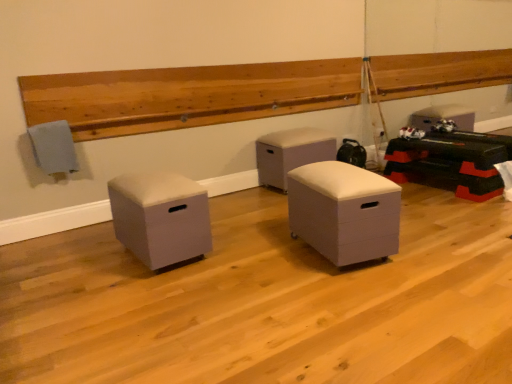
Question: Should I look upward or downward to see white leather ottoman at center, acting as the 2th furniture starting from the left?

Choices:
 (A) up
 (B) down

Answer: (A)

Question: Which direction should I rotate to look at white matte storage ottoman at center, which is counted as the third furniture, starting from the back?

Choices:
 (A) left
 (B) right

Answer: (B)

Question: From a real-world perspective, is white leather ottoman at center, the 2th furniture in the right-to-left sequence, positioned under matte gray ottoman at left, which is the 1th furniture from left to right, based on gravity?

Choices:
 (A) no
 (B) yes

Answer: (A)

Question: Can you confirm if white leather ottoman at center, the 1th furniture in the back-to-front sequence, is smaller than matte gray ottoman at left, the second furniture positioned from the back?

Choices:
 (A) yes
 (B) no

Answer: (B)

Question: Can you confirm if white leather ottoman at center, the 2th furniture in the right-to-left sequence, is taller than matte gray ottoman at left, which is the 1th furniture from left to right?

Choices:
 (A) no
 (B) yes

Answer: (B)

Question: Is white leather ottoman at center, acting as the 2th furniture starting from the left, oriented away from matte gray ottoman at left, the second furniture positioned from the back?

Choices:
 (A) yes
 (B) no

Answer: (B)

Question: Is white leather ottoman at center, acting as the 2th furniture starting from the left, not inside matte gray ottoman at left, which is the 1th furniture from left to right?

Choices:
 (A) yes
 (B) no

Answer: (A)

Question: Can you confirm if white leather ottoman at center, acting as the 2th furniture starting from the left, is shorter than matte gray ottoman at left, the third furniture when ordered from right to left?

Choices:
 (A) yes
 (B) no

Answer: (B)

Question: From the image's perspective, does white leather ottoman at center, which appears as the 3th furniture when viewed from the front, appear higher than white matte storage ottoman at center, which is counted as the third furniture, starting from the back?

Choices:
 (A) no
 (B) yes

Answer: (B)

Question: Is the depth of white leather ottoman at center, the 1th furniture in the back-to-front sequence, greater than that of white matte storage ottoman at center, which is counted as the third furniture, starting from the left?

Choices:
 (A) yes
 (B) no

Answer: (A)

Question: Is white leather ottoman at center, the 1th furniture in the back-to-front sequence, closer to the viewer compared to white matte storage ottoman at center, which is counted as the third furniture, starting from the left?

Choices:
 (A) yes
 (B) no

Answer: (B)

Question: Is white leather ottoman at center, the 1th furniture in the back-to-front sequence, smaller than white matte storage ottoman at center, the first furniture viewed from the front?

Choices:
 (A) yes
 (B) no

Answer: (B)

Question: Considering the relative sizes of white leather ottoman at center, acting as the 2th furniture starting from the left, and white matte storage ottoman at center, which ranks as the 1th furniture in right-to-left order, in the image provided, is white leather ottoman at center, acting as the 2th furniture starting from the left, thinner than white matte storage ottoman at center, which ranks as the 1th furniture in right-to-left order,?

Choices:
 (A) yes
 (B) no

Answer: (B)

Question: From a real-world perspective, is white leather ottoman at center, the 2th furniture in the right-to-left sequence, positioned over white matte storage ottoman at center, which ranks as the 1th furniture in right-to-left order, based on gravity?

Choices:
 (A) yes
 (B) no

Answer: (A)

Question: From the image's perspective, is matte gray ottoman at left, the second furniture positioned from the back, above white matte storage ottoman at center, the first furniture viewed from the front?

Choices:
 (A) yes
 (B) no

Answer: (B)